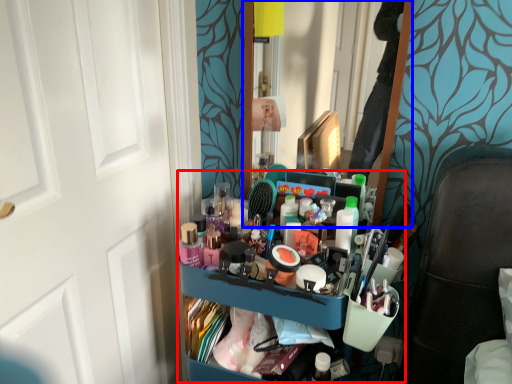
Question: Which object is further to the camera taking this photo, bookshelf (highlighted by a red box) or mirror (highlighted by a blue box)?

Choices:
 (A) bookshelf
 (B) mirror

Answer: (B)